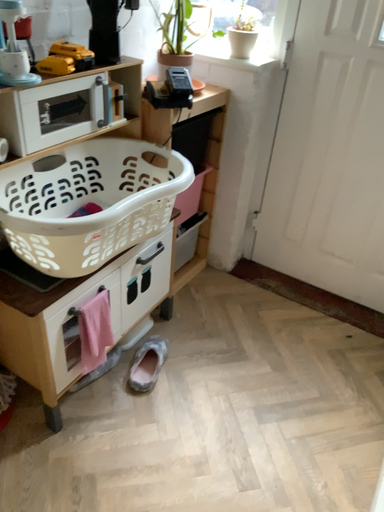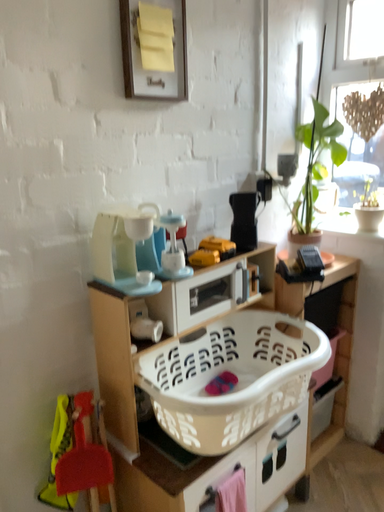
Question: How did the camera likely rotate when shooting the video?

Choices:
 (A) rotated downward
 (B) rotated upward

Answer: (B)